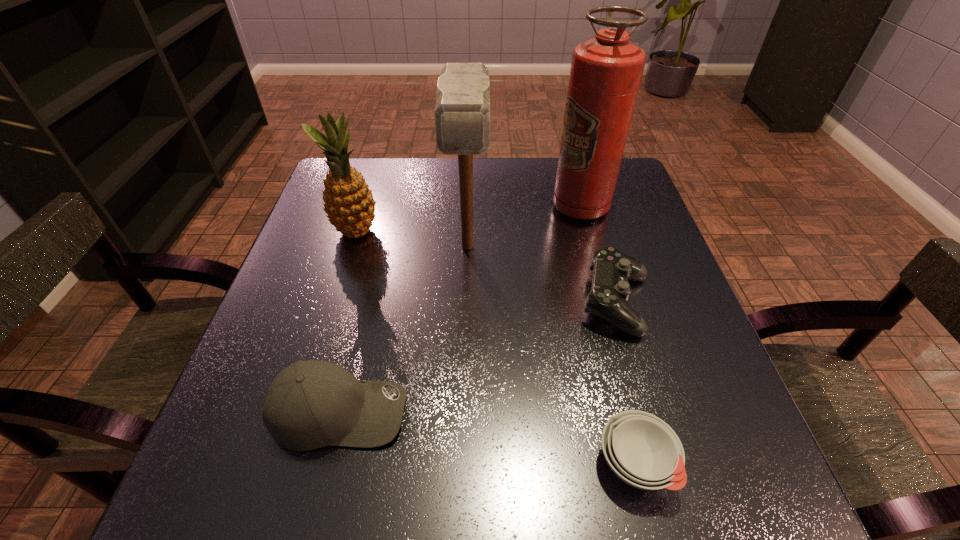
Choose which object is the fourth nearest neighbor to the fire extinguisher. Please provide its 2D coordinates. Your answer should be formatted as a tuple, i.e. [(x, y)], where the tuple contains the x and y coordinates of a point satisfying the conditions above.

[(642, 450)]

What are the coordinates of `blank space that satisfies the following two spatial constraints: 1. on the front side of the fourth shortest object; 2. on the left side of the control` in the screenshot? It's located at (334, 303).

Locate an element on the screen. The height and width of the screenshot is (540, 960). vacant space that satisfies the following two spatial constraints: 1. on the striking face of the mallet; 2. on the front brim of the baseball cap is located at coordinates (463, 411).

Locate an element on the screen. The width and height of the screenshot is (960, 540). blank area in the image that satisfies the following two spatial constraints: 1. on the striking face of the mallet; 2. on the right side of the fifth tallest object is located at coordinates (466, 303).

At what (x,y) coordinates should I click in order to perform the action: click on vacant space that satisfies the following two spatial constraints: 1. on the striking face of the mallet; 2. on the front brim of the baseball cap. Please return your answer as a coordinate pair (x, y). The image size is (960, 540). Looking at the image, I should click on (463, 411).

The image size is (960, 540). What are the coordinates of `blank area in the image that satisfies the following two spatial constraints: 1. on the front brim of the soup bowl; 2. on the right side of the baseball cap` in the screenshot? It's located at pyautogui.click(x=326, y=462).

This screenshot has width=960, height=540. I want to click on vacant space that satisfies the following two spatial constraints: 1. on the back side of the soup bowl; 2. on the front brim of the third shortest object, so click(622, 411).

What are the coordinates of `vacant space that satisfies the following two spatial constraints: 1. on the striking face of the fourth object from right to left; 2. on the left side of the soup bowl` in the screenshot? It's located at (461, 462).